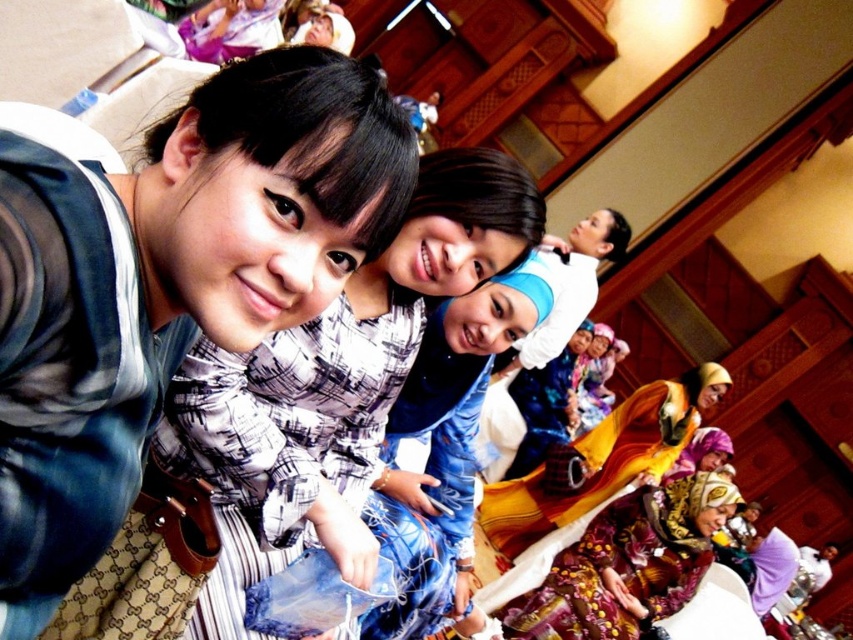
Question: Can you confirm if printed silk dress at lower right is smaller than yellow satin dress at lower right?

Choices:
 (A) yes
 (B) no

Answer: (A)

Question: Estimate the real-world distances between objects in this image. Which object is farther from the yellow satin dress at lower right?

Choices:
 (A) printed silk dress at lower right
 (B) matte blue dress at center
 (C) matte black shirt at center

Answer: (C)

Question: Does printed silk dress at lower right have a greater width compared to yellow satin dress at lower right?

Choices:
 (A) yes
 (B) no

Answer: (B)

Question: Which point appears farthest from the camera in this image?

Choices:
 (A) (543, 621)
 (B) (668, 381)

Answer: (B)

Question: Estimate the real-world distances between objects in this image. Which object is closer to the matte blue dress at center?

Choices:
 (A) matte black shirt at center
 (B) yellow satin dress at lower right

Answer: (A)

Question: Can you confirm if printed silk dress at lower right is positioned below yellow satin dress at lower right?

Choices:
 (A) yes
 (B) no

Answer: (A)